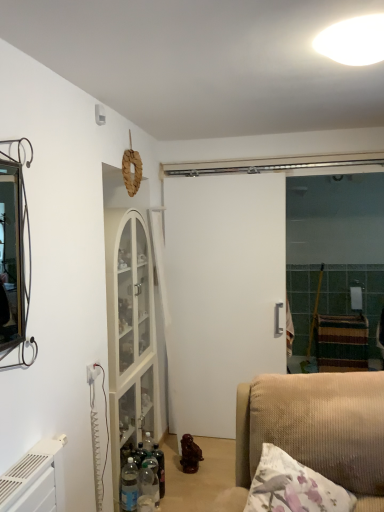
Where is `vacant area on top of white matte door at center (from a real-world perspective)`? The width and height of the screenshot is (384, 512). vacant area on top of white matte door at center (from a real-world perspective) is located at coordinates (232, 172).